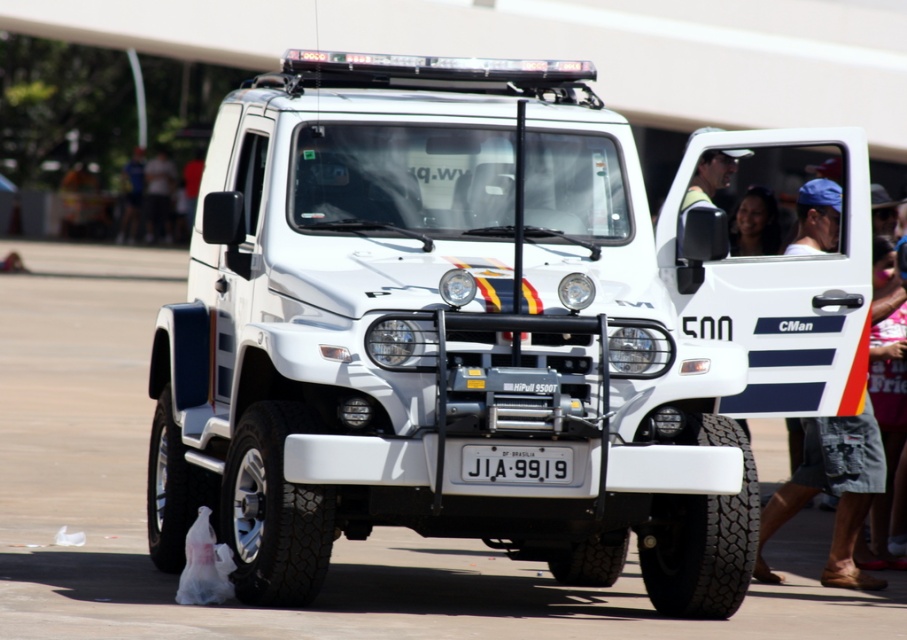
You are a photographer trying to capture the white matte truck at center and the white plastic license plate at center in a single frame. Based on their heights, which object should you focus on first to ensure both are in the frame?

The white matte truck at center has a lesser height compared to the white plastic license plate at center, so you should focus on the white plastic license plate at center first to ensure both are in the frame.

You are a photographer trying to capture the blue denim shorts at right and the white plastic license plate at center in a single frame. Which object should you focus on first to ensure both are in the frame without moving the camera?

You should focus on the white plastic license plate at center first because it is smaller in size compared to the blue denim shorts at right, ensuring both fit within the frame.